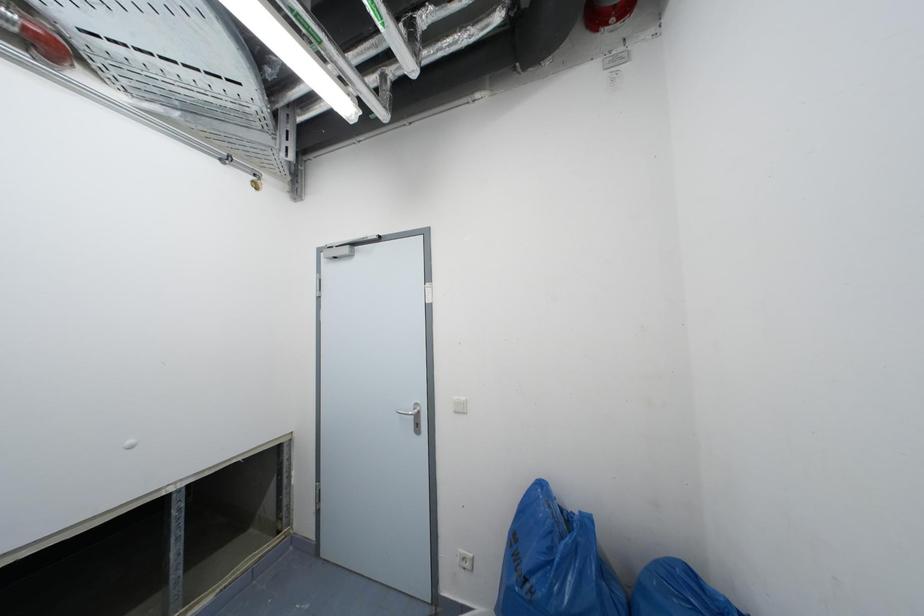
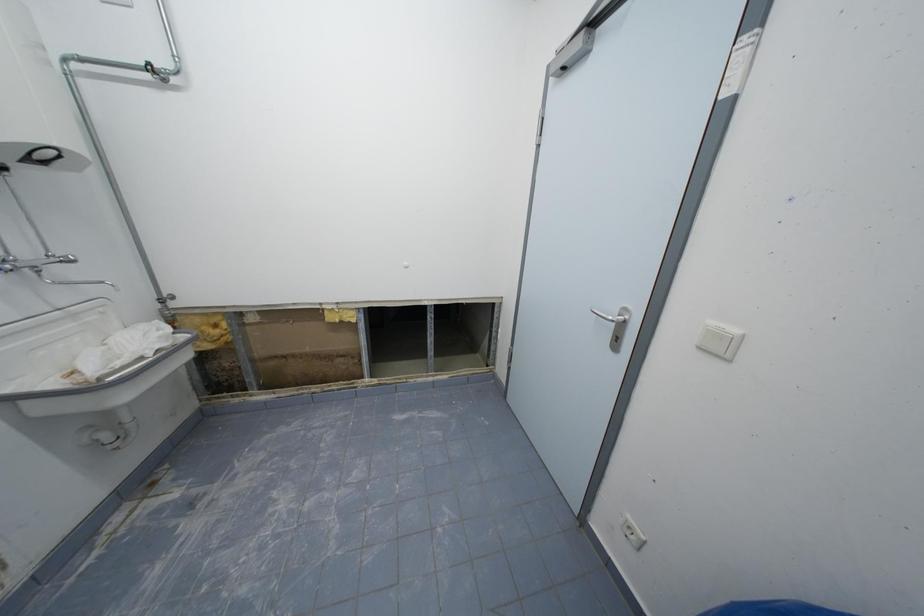
How did the camera likely rotate?

The camera's rotation is toward left-down.